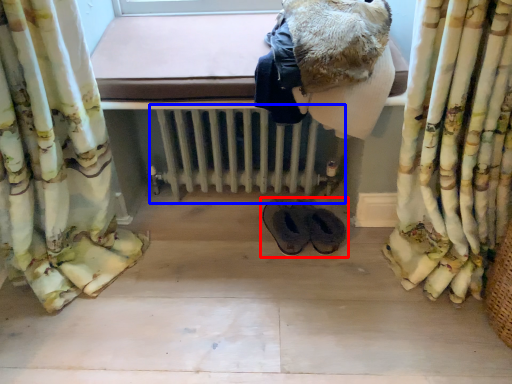
Question: Among these objects, which one is farthest to the camera, footwear (highlighted by a red box) or radiator (highlighted by a blue box)?

Choices:
 (A) footwear
 (B) radiator

Answer: (A)